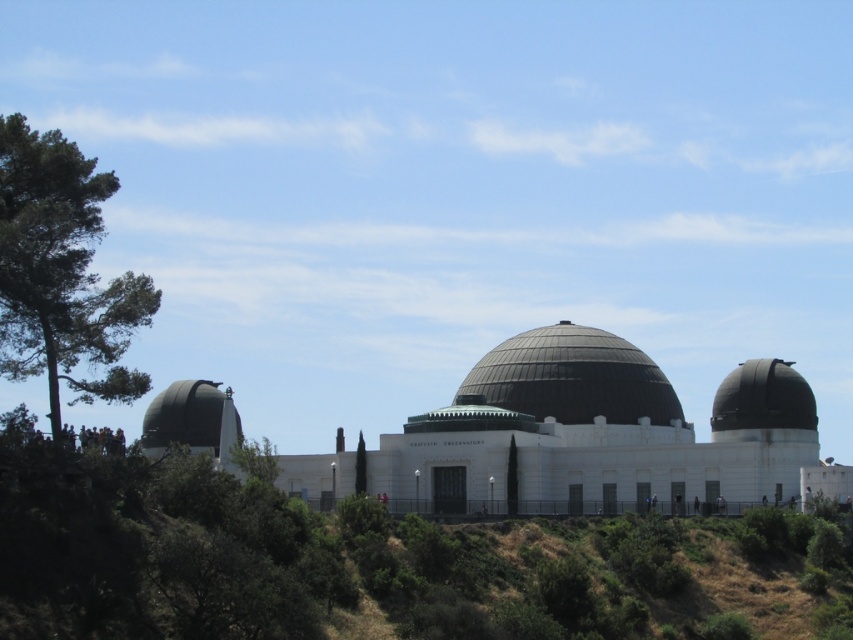
You are planning to visit the Griffith Observatory and want to take a photo of both the shiny black dome at right and the matte gray dome at left. Since you have a wide angle lens, which dome should you focus on to ensure both are in frame?

The shiny black dome at right is smaller than the matte gray dome at left, so focusing on the matte gray dome at left would help ensure both are in frame as it is larger and central.